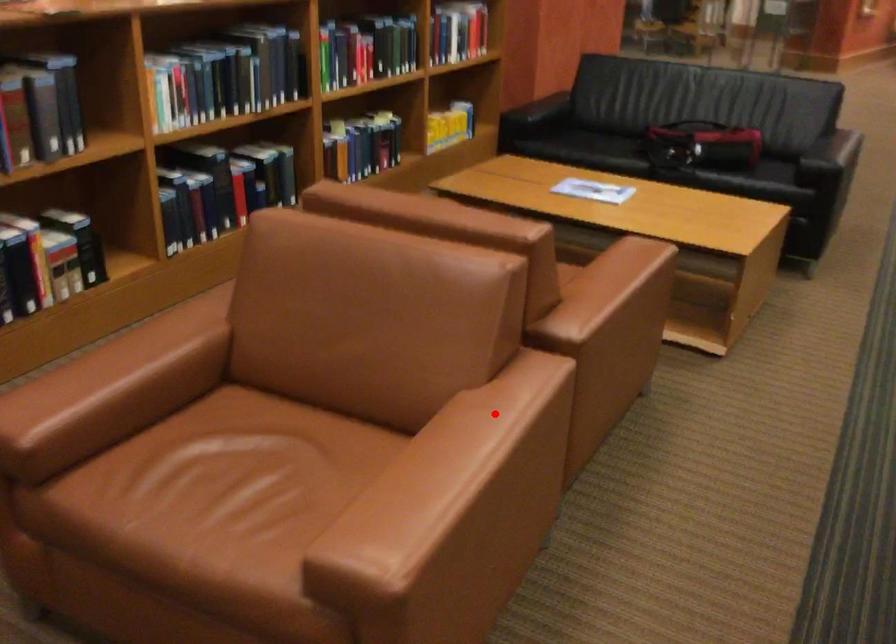
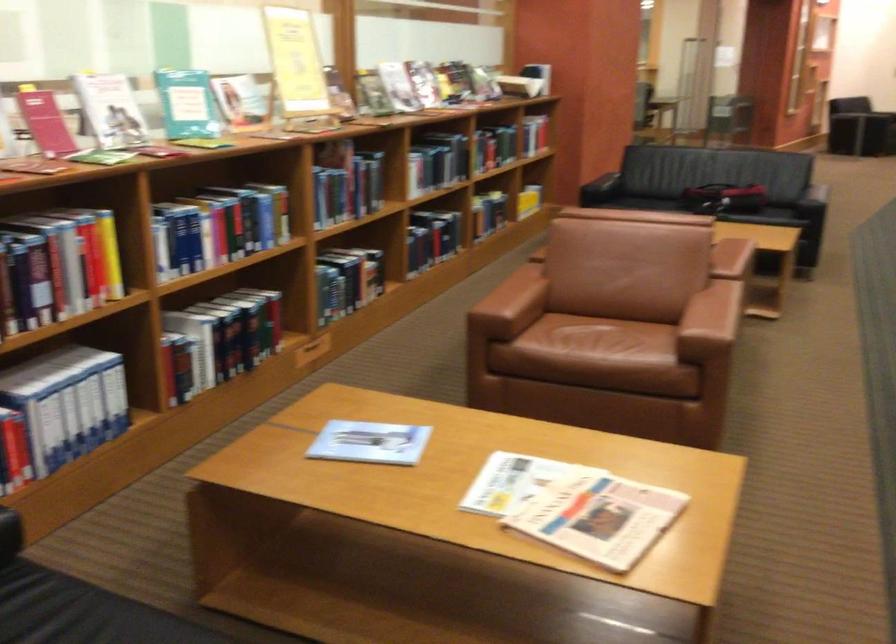
Locate, in the second image, the point that corresponds to the highlighted location in the first image.

(719, 296)